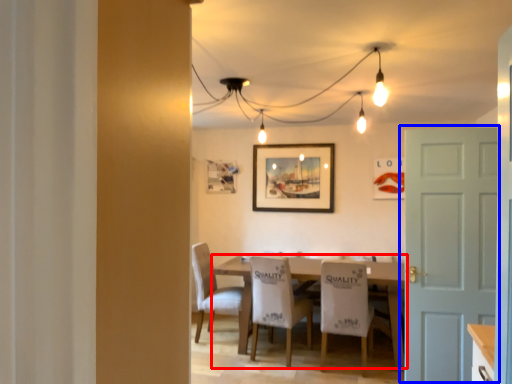
Question: Among these objects, which one is farthest to the camera, table (highlighted by a red box) or door (highlighted by a blue box)?

Choices:
 (A) table
 (B) door

Answer: (A)